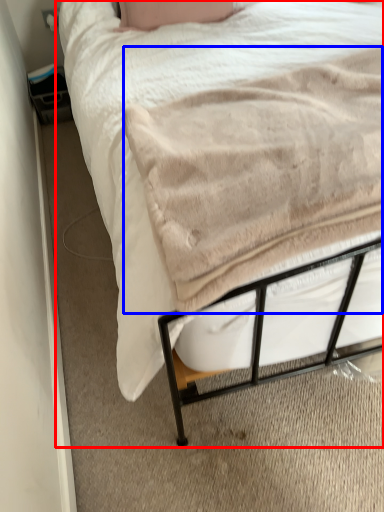
Question: Among these objects, which one is nearest to the camera, bed (highlighted by a red box) or blanket (highlighted by a blue box)?

Choices:
 (A) bed
 (B) blanket

Answer: (B)